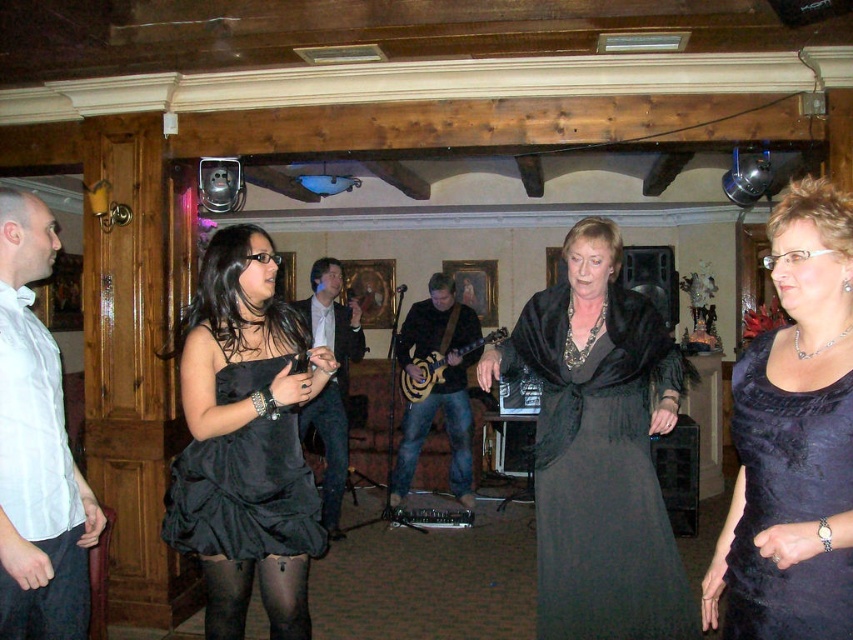
Question: From the image, what is the correct spatial relationship of white satin shirt at left in relation to black fabric pants at lower left?

Choices:
 (A) left
 (B) right

Answer: (A)

Question: Based on their relative distances, which object is nearer to the jeans at center?

Choices:
 (A) black fabric pants at lower left
 (B) black satin jacket at center
 (C) matte black dress at center
 (D) black satin dress at right

Answer: (B)

Question: Among these points, which one is farthest from the camera?

Choices:
 (A) tap(434, 285)
 (B) tap(10, 266)
 (C) tap(467, 408)
 (D) tap(85, 554)

Answer: (C)

Question: Which point is farther to the camera?

Choices:
 (A) wooden electric guitar at center
 (B) jeans at center
 (C) matte black dress at center

Answer: (B)

Question: Is white satin shirt at left closer to camera compared to black satin jacket at center?

Choices:
 (A) no
 (B) yes

Answer: (B)

Question: Can you confirm if black satin dress at right is positioned to the right of jeans at center?

Choices:
 (A) no
 (B) yes

Answer: (B)